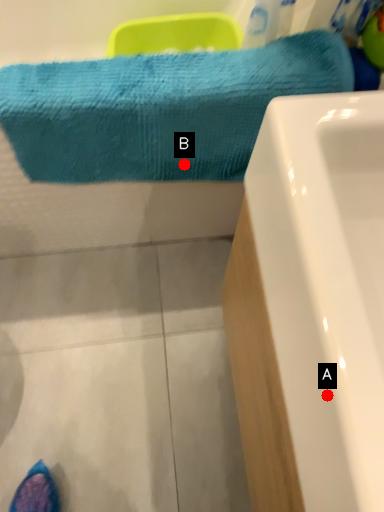
Question: Two points are circled on the image, labeled by A and B beside each circle. Which point appears closest to the camera in this image?

Choices:
 (A) A is closer
 (B) B is closer

Answer: (A)